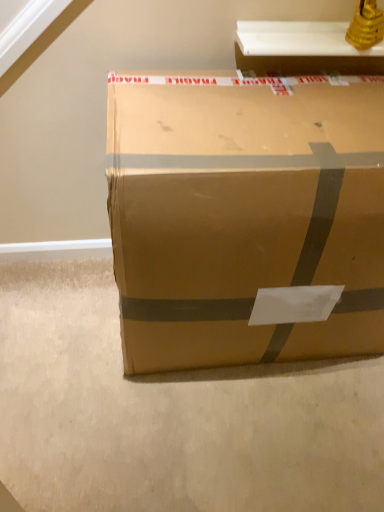
Question: Is the position of brown cardboard box at center more distant than that of white glossy shelf at upper center?

Choices:
 (A) no
 (B) yes

Answer: (A)

Question: From a real-world perspective, is brown cardboard box at center physically below white glossy shelf at upper center?

Choices:
 (A) yes
 (B) no

Answer: (A)

Question: Is brown cardboard box at center at the left side of white glossy shelf at upper center?

Choices:
 (A) no
 (B) yes

Answer: (B)

Question: Is white glossy shelf at upper center located within brown cardboard box at center?

Choices:
 (A) yes
 (B) no

Answer: (B)

Question: Considering the relative sizes of brown cardboard box at center and white glossy shelf at upper center in the image provided, is brown cardboard box at center shorter than white glossy shelf at upper center?

Choices:
 (A) no
 (B) yes

Answer: (A)

Question: Is brown cardboard box at center at the right side of white glossy shelf at upper center?

Choices:
 (A) yes
 (B) no

Answer: (B)

Question: From a real-world perspective, does white glossy shelf at upper center sit lower than brown cardboard box at center?

Choices:
 (A) yes
 (B) no

Answer: (B)

Question: Is white glossy shelf at upper center facing away from brown cardboard box at center?

Choices:
 (A) yes
 (B) no

Answer: (B)

Question: Considering the relative positions of white glossy shelf at upper center and brown cardboard box at center in the image provided, is white glossy shelf at upper center to the right of brown cardboard box at center from the viewer's perspective?

Choices:
 (A) yes
 (B) no

Answer: (A)

Question: Does white glossy shelf at upper center have a smaller size compared to brown cardboard box at center?

Choices:
 (A) no
 (B) yes

Answer: (B)

Question: Does white glossy shelf at upper center have a larger size compared to brown cardboard box at center?

Choices:
 (A) yes
 (B) no

Answer: (B)

Question: Does white glossy shelf at upper center contain brown cardboard box at center?

Choices:
 (A) no
 (B) yes

Answer: (A)

Question: Does point (144, 353) appear closer or farther from the camera than point (312, 70)?

Choices:
 (A) closer
 (B) farther

Answer: (A)